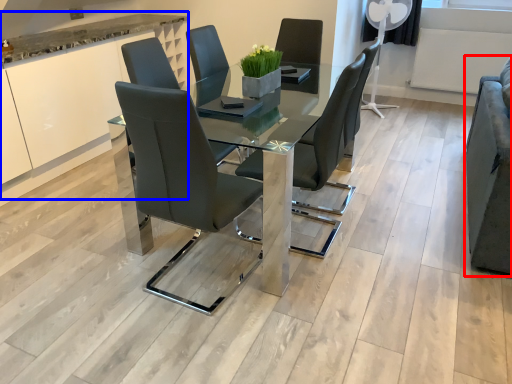
Question: Which of the following is the farthest to the observer, armchair (highlighted by a red box) or cabinetry (highlighted by a blue box)?

Choices:
 (A) armchair
 (B) cabinetry

Answer: (B)